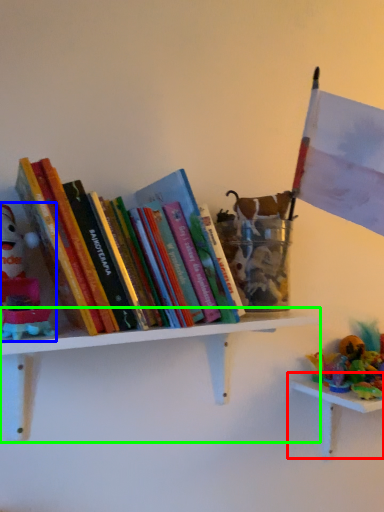
Question: Which object is the farthest from table (highlighted by a red box)? Choose among these: toy (highlighted by a blue box) or shelf (highlighted by a green box).

Choices:
 (A) toy
 (B) shelf

Answer: (A)